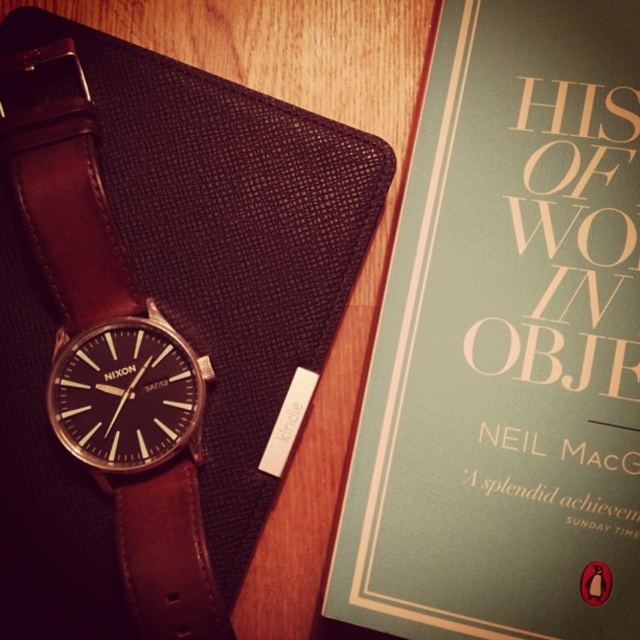
Question: Which of the following is the farthest from the observer?

Choices:
 (A) teal matte book at upper right
 (B) brown leather strap at left

Answer: (B)

Question: Is teal matte book at upper right to the left of brown leather strap at left from the viewer's perspective?

Choices:
 (A) no
 (B) yes

Answer: (A)

Question: Which object appears closest to the camera in this image?

Choices:
 (A) brown leather strap at left
 (B) teal matte book at upper right

Answer: (B)

Question: Does teal matte book at upper right appear under brown leather strap at left?

Choices:
 (A) no
 (B) yes

Answer: (A)

Question: Considering the relative positions of teal matte book at upper right and brown leather strap at left in the image provided, where is teal matte book at upper right located with respect to brown leather strap at left?

Choices:
 (A) below
 (B) above

Answer: (B)